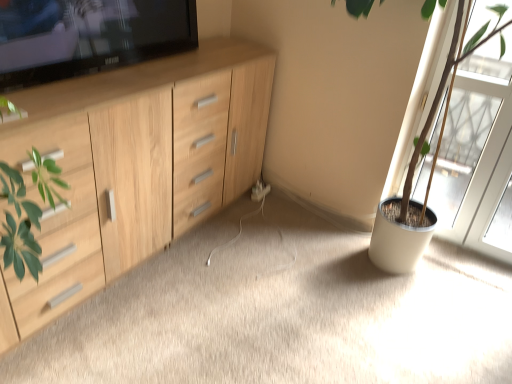
Locate an element on the screen. Image resolution: width=512 pixels, height=384 pixels. free space in front of green matte plant pot at right is located at coordinates pos(448,259).